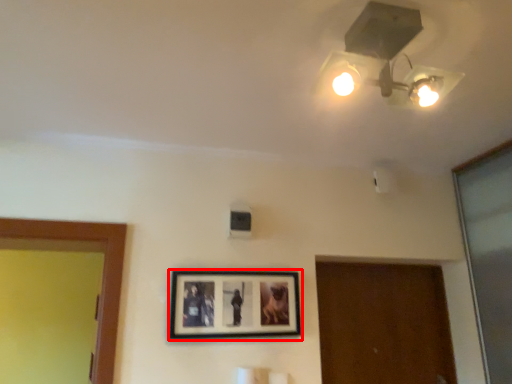
Question: From the image's perspective, what is the correct spatial relationship of picture frame (annotated by the red box) in relation to lamp?

Choices:
 (A) above
 (B) below

Answer: (B)